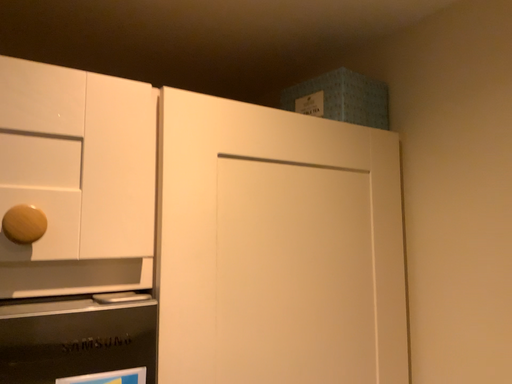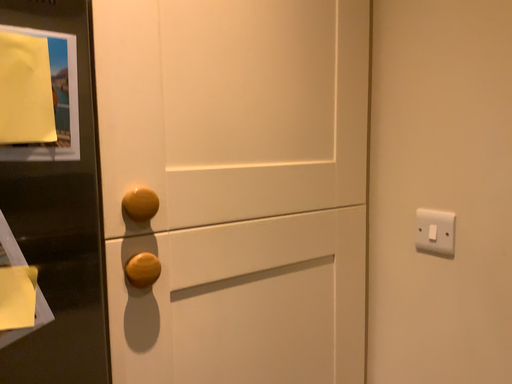
Question: Which way did the camera rotate in the video?

Choices:
 (A) rotated downward
 (B) rotated upward

Answer: (A)